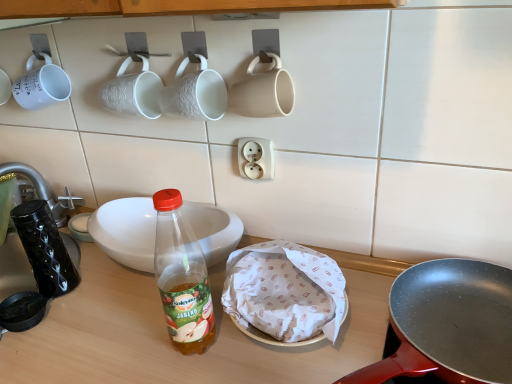
Identify the location of free space in front of black glossy coffee cup at left. The height and width of the screenshot is (384, 512). (70, 336).